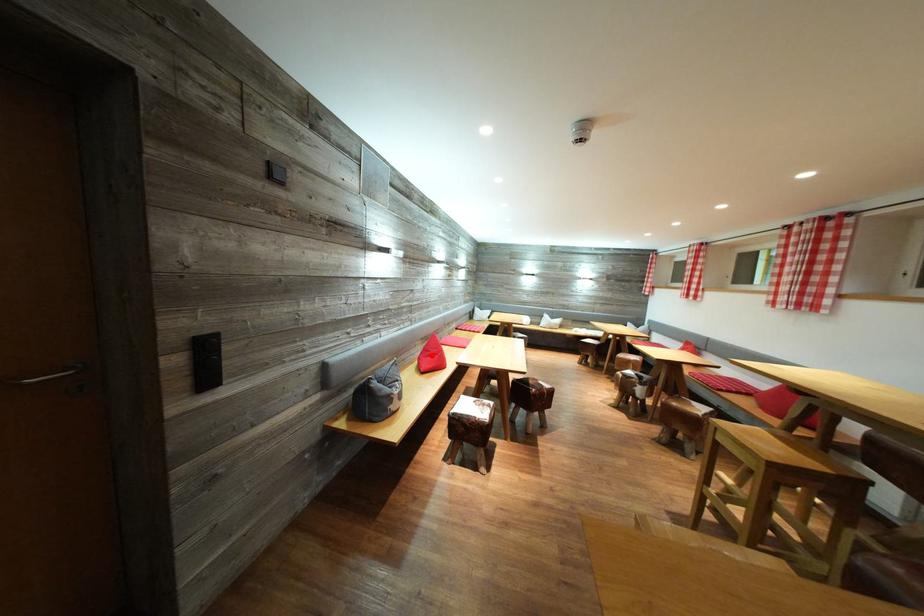
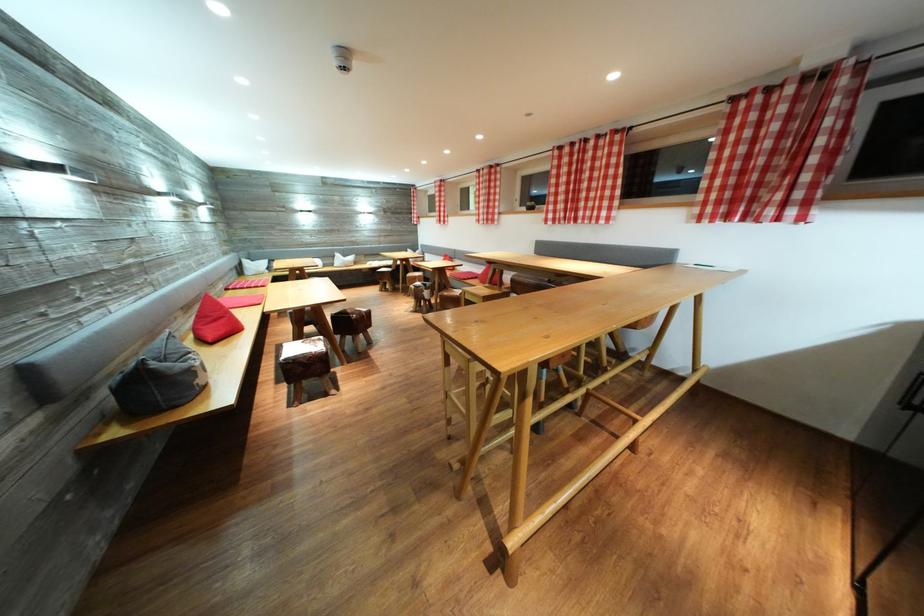
Question: A red point is marked in image1. In image2, is the corresponding 3D point closer to the camera or farther? Reply with the corresponding letter.

Choices:
 (A) The corresponding 3D point is closer.
 (B) The corresponding 3D point is farther.

Answer: (A)